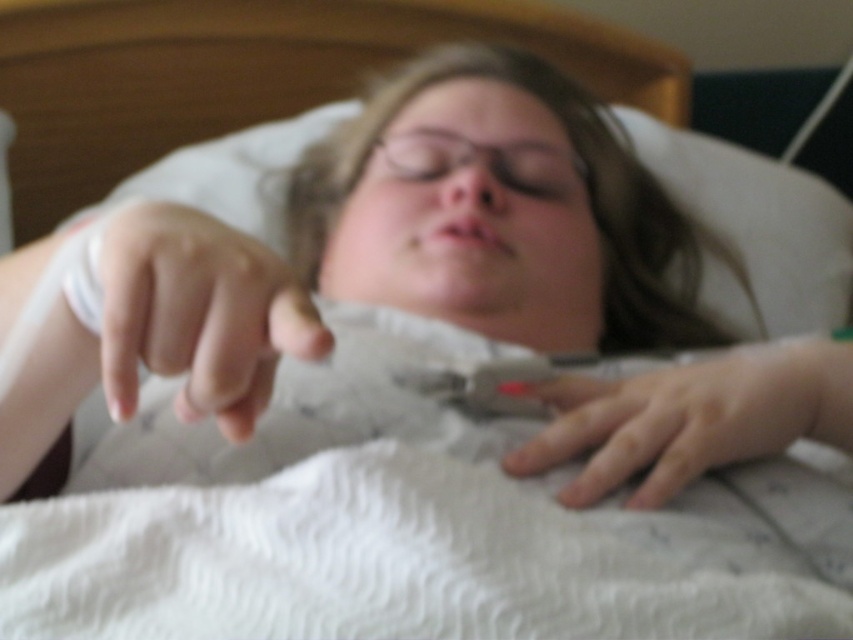
Can you confirm if smooth skin finger at center is taller than smooth skin hand at lower center?

Yes.

Does point (227, 422) come closer to viewer compared to point (807, 358)?

Yes, point (227, 422) is closer to viewer.

You are a GUI agent. You are given a task and a screenshot of the screen. Output one action in this format:
    pyautogui.click(x=<x>, y=<y>)
    Task: Click on the smooth skin finger at center
    Image resolution: width=853 pixels, height=640 pixels.
    Given the screenshot: What is the action you would take?
    pyautogui.click(x=198, y=314)